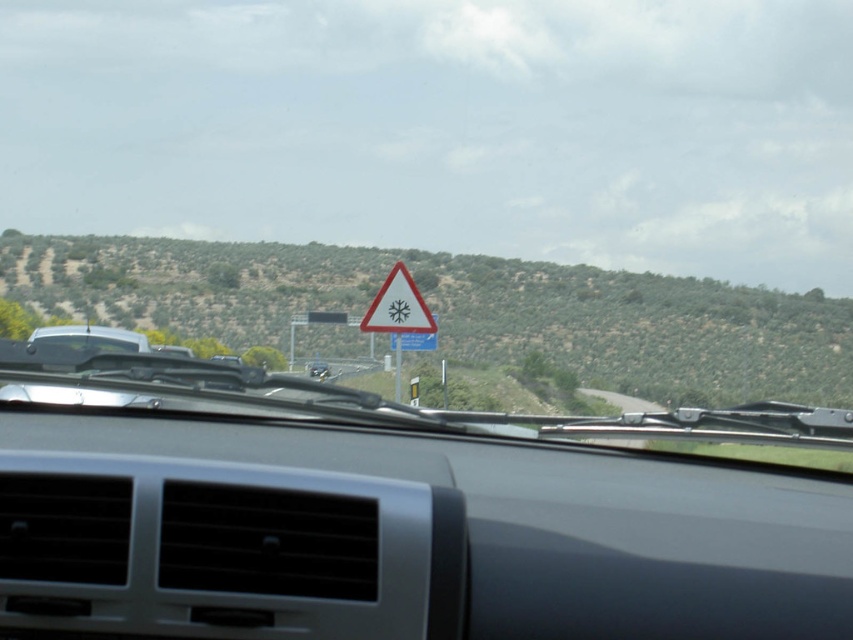
You are driving a car and see the white triangular warning sign at center and the matte black car at center ahead on the road. Which object is closer to you?

The white triangular warning sign at center is closer to the viewer than the matte black car at center.

You are driving and need to focus on the road ahead. Which object, the metallic dashboard at center or the white triangular warning sign at center, is located lower in your view?

The metallic dashboard at center is positioned under the white triangular warning sign at center, so the metallic dashboard at center is lower in your view.